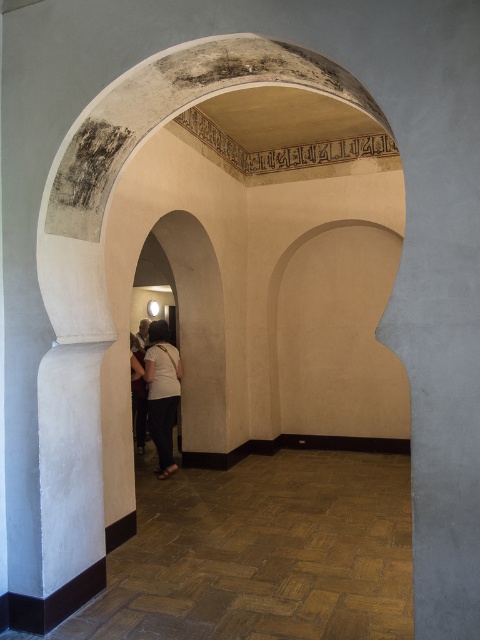
You are standing at the entrance of this historical building and want to reach the white cotton shirt at center without stepping on the brown parquet floor at lower center. Can you walk around it? Please explain why or why not.

The brown parquet floor at lower center is 4.42 feet away from the white cotton shirt at center. Since the distance is relatively short, you can easily walk around the brown parquet floor at lower center to reach the white cotton shirt at center without stepping on it.

You are standing at the entrance of this historical building and want to walk towards the brown parquet floor at lower center. Based on the coordinates provided, in which direction should you move relative to your current position?

The brown parquet floor at lower center is located at coordinates point (x=263, y=554). Since the x coordinate is 0.866 and y is 0.548, you should move towards the right and slightly forward to reach it.